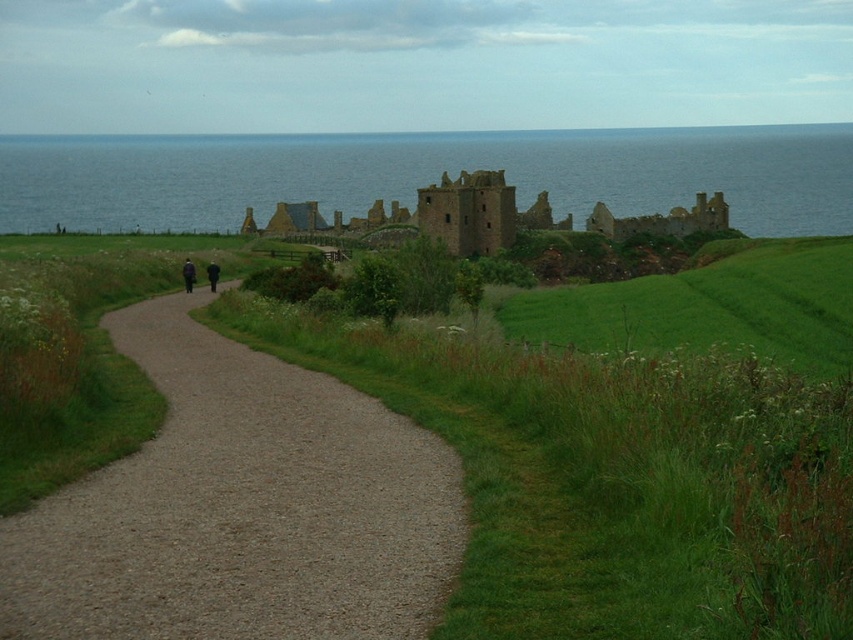
You are standing at the starting point of the dirt path in the coastal scene. You want to reach the blue water at upper center. According to the coordinates provided, what direction should you head towards from your current position?

The blue water at upper center is located at coordinates point (427,176), which is in the upper center direction. Therefore, you should head towards the upper center direction from your current position on the dirt path to reach it.

Looking at this image, you are a hiker trying to follow the gray gravel path at center to reach the historic ruin. You notice a dark wool coat at center lying on the path. Which direction should you move to avoid stepping on the coat while staying on the path?

The gray gravel path at center is to the right of dark wool coat at center, so to avoid stepping on the coat while staying on the path, you should move to the left side of the path.